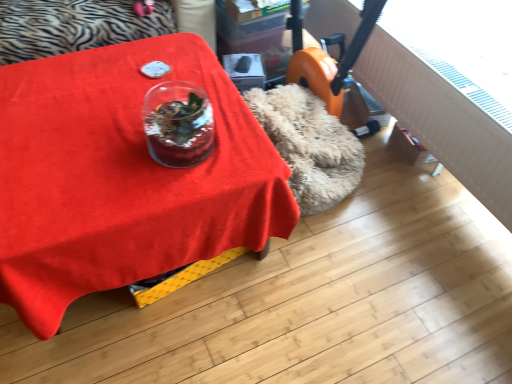
Image resolution: width=512 pixels, height=384 pixels. Identify the location of free space in front of transparent glass vase at center. (164, 188).